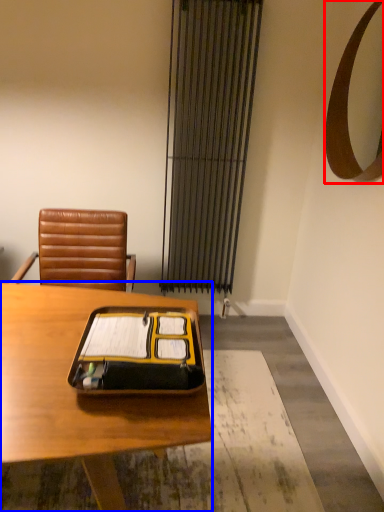
Question: Which object appears farthest to the camera in this image, mirror (highlighted by a red box) or desk (highlighted by a blue box)?

Choices:
 (A) mirror
 (B) desk

Answer: (A)